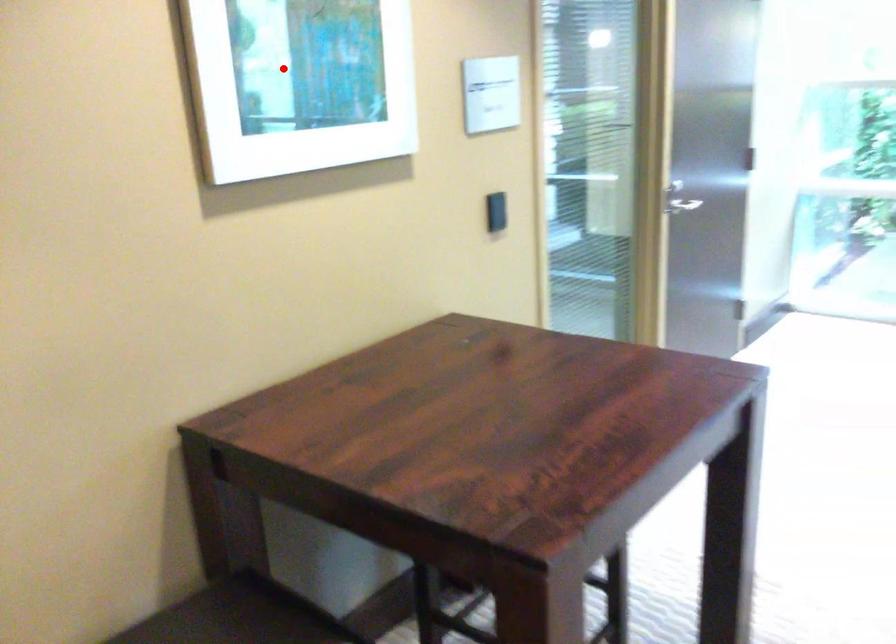
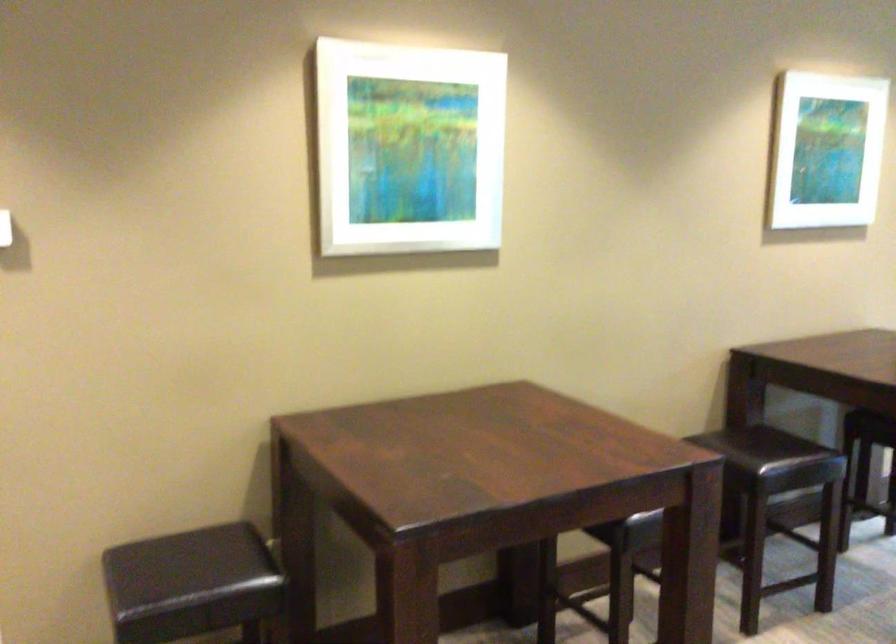
Question: I am providing you with two images of the same scene from different viewpoints. In image1, a red point is highlighted. Considering the same 3D point in image2, which of the following is correct?

Choices:
 (A) It is closer
 (B) It is farther

Answer: (B)